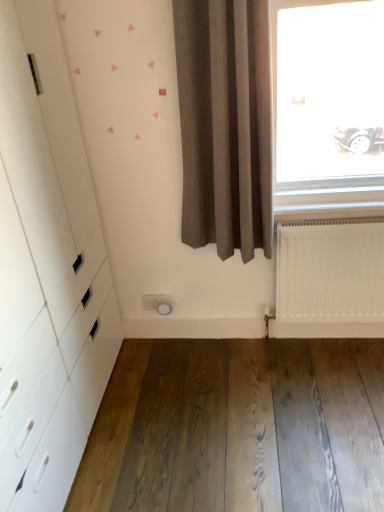
This screenshot has width=384, height=512. What do you see at coordinates (238, 428) in the screenshot?
I see `natural wood floor at lower center` at bounding box center [238, 428].

Find the location of a particular element. The width and height of the screenshot is (384, 512). natural wood floor at lower center is located at coordinates (238, 428).

The image size is (384, 512). I want to click on white glossy dresser at left, so click(47, 269).

Is point (30, 81) positioned after point (191, 77)?

No.

Does white glossy dresser at left have a greater width compared to brown fabric curtain at center?

Yes.

From the image's perspective, does white glossy dresser at left appear lower than brown fabric curtain at center?

Yes.

Is white glossy dresser at left facing away from brown fabric curtain at center?

No, white glossy dresser at left is not facing the opposite direction of brown fabric curtain at center.

Image resolution: width=384 pixels, height=512 pixels. Find the location of `hardwood on the right of brown fabric curtain at center`. hardwood on the right of brown fabric curtain at center is located at coordinates (238, 428).

Between natural wood floor at lower center and brown fabric curtain at center, which one has smaller width?

Thinner between the two is brown fabric curtain at center.

Between natural wood floor at lower center and brown fabric curtain at center, which one has more height?

With more height is brown fabric curtain at center.

Is natural wood floor at lower center turned away from brown fabric curtain at center?

No, natural wood floor at lower center is not facing the opposite direction of brown fabric curtain at center.

Between brown fabric curtain at center and natural wood floor at lower center, which one appears on the left side from the viewer's perspective?

Positioned to the left is brown fabric curtain at center.

Between brown fabric curtain at center and natural wood floor at lower center, which one is positioned behind?

natural wood floor at lower center.

Looking at this image, considering the sizes of brown fabric curtain at center and natural wood floor at lower center in the image, is brown fabric curtain at center taller or shorter than natural wood floor at lower center?

In the image, brown fabric curtain at center appears to be taller than natural wood floor at lower center.

Is brown fabric curtain at center wider or thinner than natural wood floor at lower center?

Clearly, brown fabric curtain at center has less width compared to natural wood floor at lower center.

From the image's perspective, does brown fabric curtain at center appear lower than white matte radiator at lower right?

→ No, from the image's perspective, brown fabric curtain at center is not beneath white matte radiator at lower right.

Is white matte radiator at lower right surrounded by brown fabric curtain at center?

No.

Is the position of brown fabric curtain at center more distant than that of white matte radiator at lower right?

No.

From a real-world perspective, is brown fabric curtain at center under white matte radiator at lower right?

No.

Is natural wood floor at lower center turned away from white matte radiator at lower right?

natural wood floor at lower center is not turned away from white matte radiator at lower right.

From a real-world perspective, is natural wood floor at lower center under white matte radiator at lower right?

Correct, in the physical world, natural wood floor at lower center is lower than white matte radiator at lower right.

Which is correct: natural wood floor at lower center is inside white matte radiator at lower right, or outside of it?

natural wood floor at lower center is not enclosed by white matte radiator at lower right.

Which is farther from the camera, (339,223) or (264,130)?

The point (339,223) is farther.

Choose the correct answer: Is white matte radiator at lower right inside brown fabric curtain at center or outside it?

white matte radiator at lower right lies outside brown fabric curtain at center.

Considering the sizes of white matte radiator at lower right and brown fabric curtain at center in the image, is white matte radiator at lower right wider or thinner than brown fabric curtain at center?

Clearly, white matte radiator at lower right has less width compared to brown fabric curtain at center.

Considering the relative positions of natural wood floor at lower center and white glossy dresser at left in the image provided, is natural wood floor at lower center to the left or to the right of white glossy dresser at left?

In the image, natural wood floor at lower center appears on the right side of white glossy dresser at left.

Where is `dresser above the natural wood floor at lower center (from a real-world perspective)`? Image resolution: width=384 pixels, height=512 pixels. dresser above the natural wood floor at lower center (from a real-world perspective) is located at coordinates (47, 269).

From a real-world perspective, which is physically below, natural wood floor at lower center or white glossy dresser at left?

From a 3D spatial view, natural wood floor at lower center is below.

What's the angular difference between natural wood floor at lower center and white glossy dresser at left's facing directions?

The facing directions of natural wood floor at lower center and white glossy dresser at left are 0.0996 degrees apart.

There is a white glossy dresser at left. Where is `curtain above it (from a real-world perspective)`? curtain above it (from a real-world perspective) is located at coordinates [225, 124].

Find the location of a particular element. The height and width of the screenshot is (512, 384). curtain lying above the natural wood floor at lower center (from the image's perspective) is located at coordinates (225, 124).

From the image, which object appears to be nearer to natural wood floor at lower center, brown fabric curtain at center or white glossy dresser at left?

white glossy dresser at left.

When comparing their distances from white matte radiator at lower right, does natural wood floor at lower center or brown fabric curtain at center seem closer?

brown fabric curtain at center is closer to white matte radiator at lower right.

From the image, which object appears to be nearer to white matte radiator at lower right, brown fabric curtain at center or white glossy dresser at left?

The object closer to white matte radiator at lower right is brown fabric curtain at center.

Based on their spatial positions, is white matte radiator at lower right or white glossy dresser at left further from brown fabric curtain at center?

white glossy dresser at left.

Considering their positions, is brown fabric curtain at center positioned further to white glossy dresser at left than white matte radiator at lower right?

white matte radiator at lower right lies further to white glossy dresser at left than the other object.

Considering their positions, is white glossy dresser at left positioned closer to white matte radiator at lower right than natural wood floor at lower center?

Based on the image, natural wood floor at lower center appears to be nearer to white matte radiator at lower right.

Which object lies nearer to the anchor point brown fabric curtain at center, white glossy dresser at left or natural wood floor at lower center?

white glossy dresser at left is closer to brown fabric curtain at center.

Based on their spatial positions, is brown fabric curtain at center or white matte radiator at lower right closer to natural wood floor at lower center?

white matte radiator at lower right is closer to natural wood floor at lower center.

At what (x,y) coordinates should I click in order to perform the action: click on hardwood between white glossy dresser at left and white matte radiator at lower right in the horizontal direction. Please return your answer as a coordinate pair (x, y). The width and height of the screenshot is (384, 512). Looking at the image, I should click on (238, 428).

The image size is (384, 512). Find the location of `curtain between white glossy dresser at left and white matte radiator at lower right from left to right`. curtain between white glossy dresser at left and white matte radiator at lower right from left to right is located at coordinates (225, 124).

Identify the location of radiator between brown fabric curtain at center and natural wood floor at lower center vertically. Image resolution: width=384 pixels, height=512 pixels. (330, 279).

Where is `dresser between brown fabric curtain at center and natural wood floor at lower center vertically`? The height and width of the screenshot is (512, 384). dresser between brown fabric curtain at center and natural wood floor at lower center vertically is located at coordinates (47, 269).